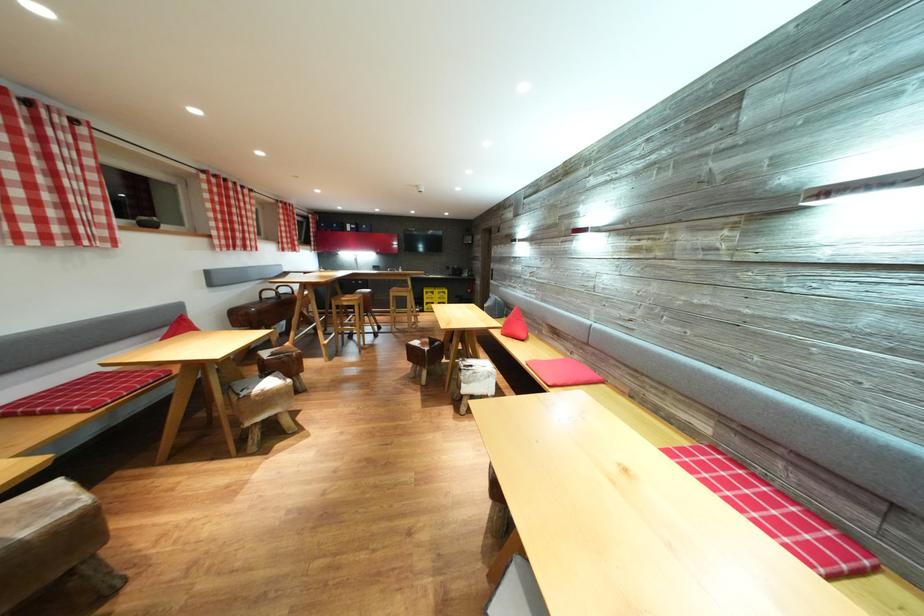
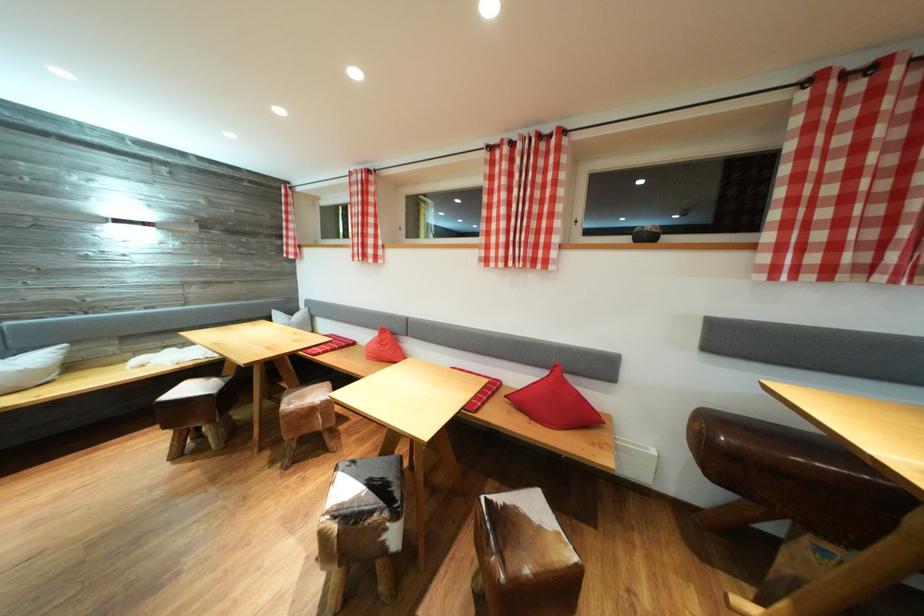
Locate, in the second image, the point that corresponds to pixel 220 177 in the first image.

(869, 66)